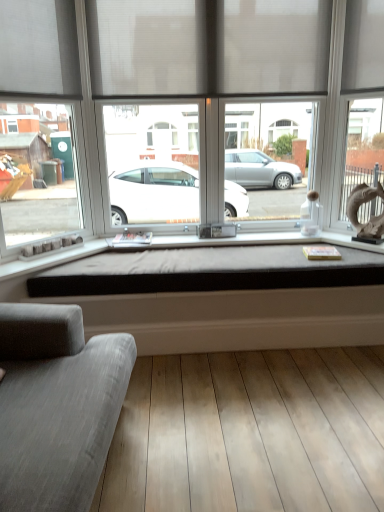
Question: Is light brown wood floor at lower center bigger than matte gray window at center?

Choices:
 (A) no
 (B) yes

Answer: (A)

Question: Is matte gray window at center surrounded by light brown wood floor at lower center?

Choices:
 (A) no
 (B) yes

Answer: (A)

Question: From a real-world perspective, is light brown wood floor at lower center located beneath matte gray window at center?

Choices:
 (A) yes
 (B) no

Answer: (A)

Question: Is light brown wood floor at lower center outside of matte gray window at center?

Choices:
 (A) yes
 (B) no

Answer: (A)

Question: Can you confirm if light brown wood floor at lower center is positioned to the right of matte gray window at center?

Choices:
 (A) yes
 (B) no

Answer: (A)

Question: Looking at their shapes, would you say gray fabric couch at lower left is wider or thinner than matte gray curtain at upper center?

Choices:
 (A) wide
 (B) thin

Answer: (A)

Question: From their relative heights in the image, would you say gray fabric couch at lower left is taller or shorter than matte gray curtain at upper center?

Choices:
 (A) tall
 (B) short

Answer: (A)

Question: From the image's perspective, is gray fabric couch at lower left above or below matte gray curtain at upper center?

Choices:
 (A) above
 (B) below

Answer: (B)

Question: Relative to matte gray curtain at upper center, is gray fabric couch at lower left in front or behind?

Choices:
 (A) behind
 (B) front

Answer: (B)

Question: From a real-world perspective, relative to matte gray window at center, is gray fabric couch at lower left vertically above or below?

Choices:
 (A) below
 (B) above

Answer: (A)

Question: Considering the positions of gray fabric couch at lower left and matte gray window at center in the image, is gray fabric couch at lower left taller or shorter than matte gray window at center?

Choices:
 (A) short
 (B) tall

Answer: (A)

Question: Is gray fabric couch at lower left wider or thinner than matte gray window at center?

Choices:
 (A) wide
 (B) thin

Answer: (A)

Question: Looking at the image, does gray fabric couch at lower left seem bigger or smaller compared to matte gray window at center?

Choices:
 (A) big
 (B) small

Answer: (A)

Question: Is matte gray curtain at upper center situated inside matte gray window at center or outside?

Choices:
 (A) outside
 (B) inside

Answer: (B)

Question: From the image's perspective, is matte gray curtain at upper center located above or below matte gray window at center?

Choices:
 (A) above
 (B) below

Answer: (A)